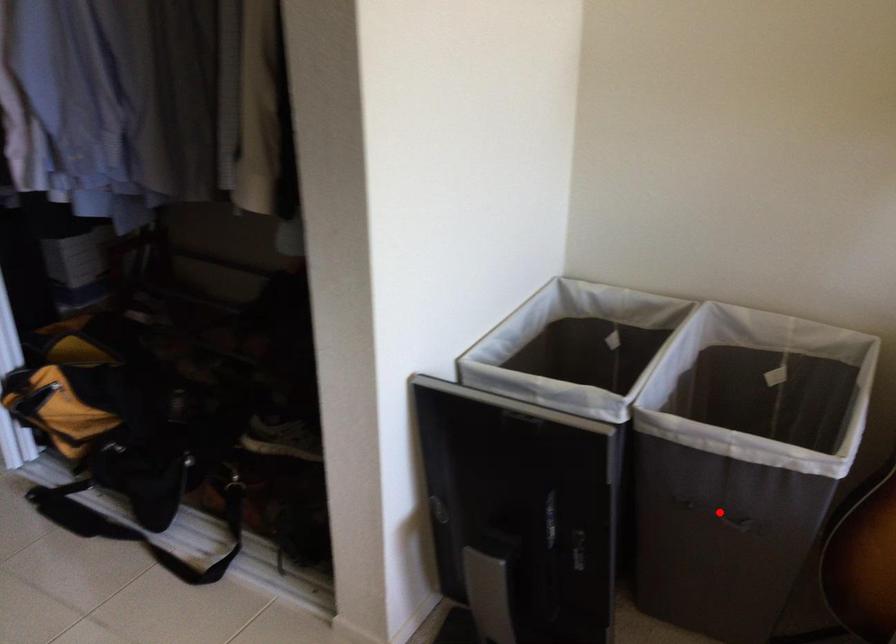
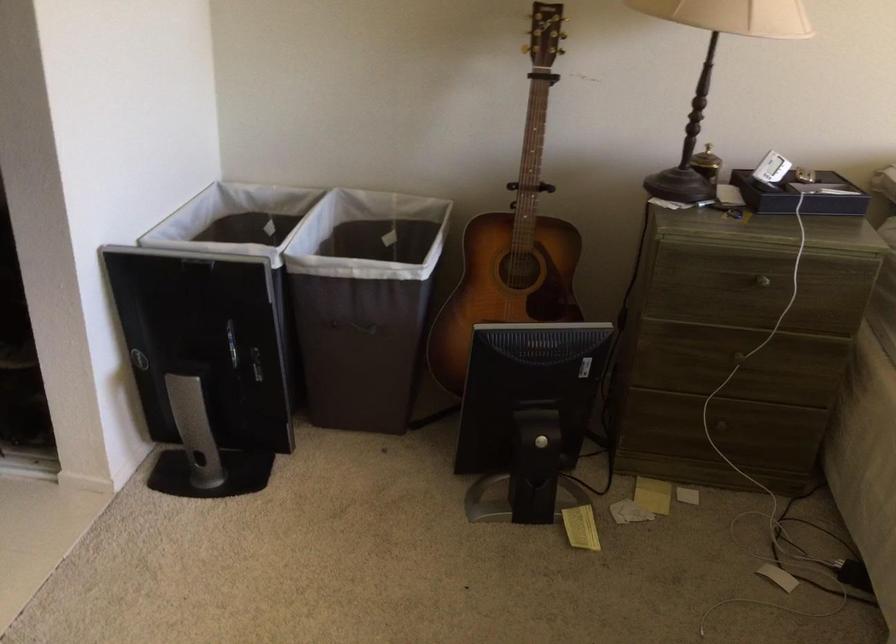
Where in the second image is the point corresponding to the highlighted location from the first image?

(357, 327)